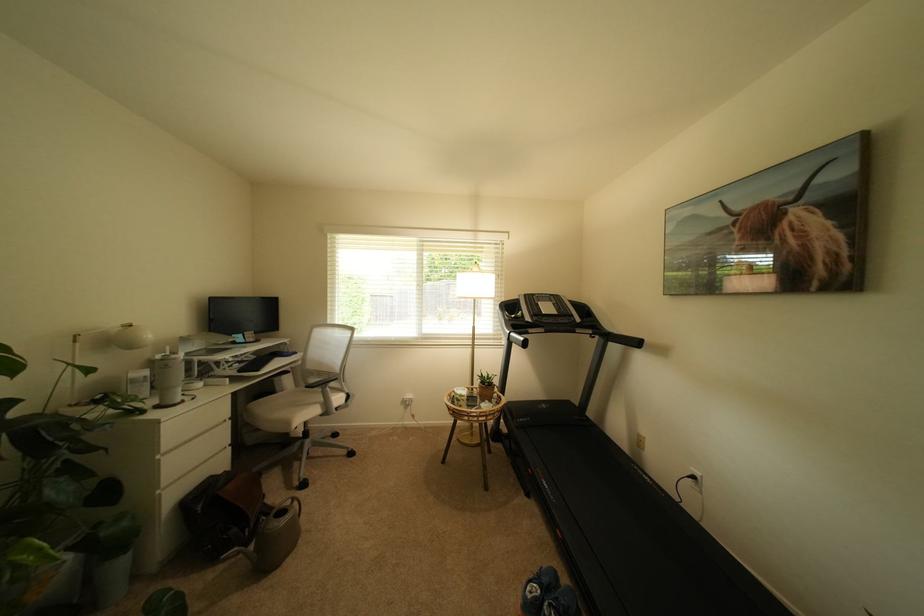
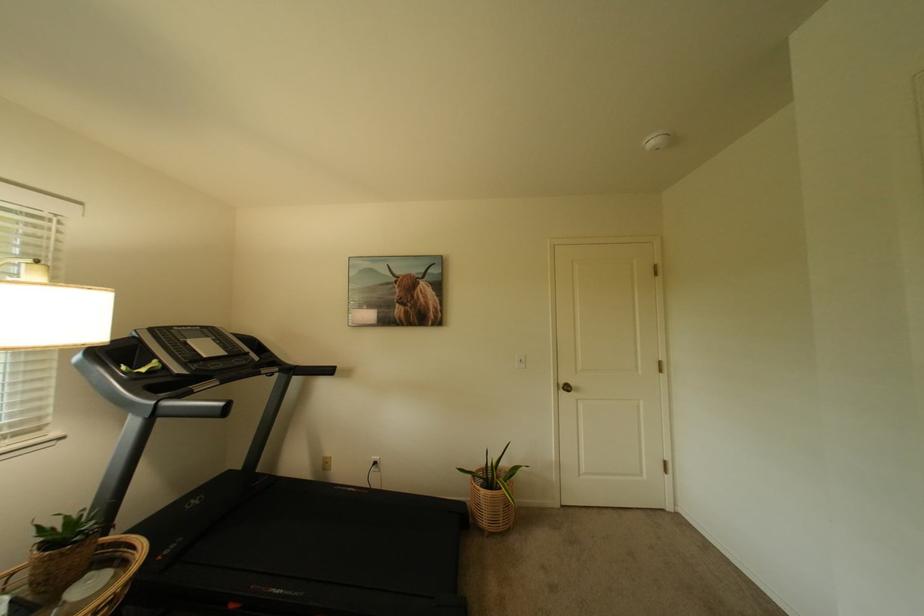
Locate, in the second image, the point that corresponds to point 538,333 in the first image.

(203, 392)